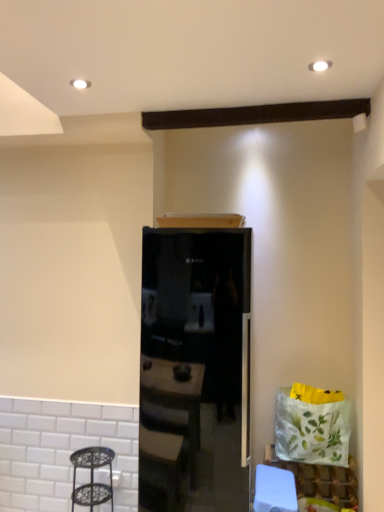
Question: Is white paper bag at lower right behind black glass refrigerator at center?

Choices:
 (A) yes
 (B) no

Answer: (A)

Question: Can you confirm if white paper bag at lower right is smaller than black glass refrigerator at center?

Choices:
 (A) yes
 (B) no

Answer: (A)

Question: Is white paper bag at lower right facing towards black glass refrigerator at center?

Choices:
 (A) yes
 (B) no

Answer: (B)

Question: Can you confirm if white paper bag at lower right is bigger than black glass refrigerator at center?

Choices:
 (A) no
 (B) yes

Answer: (A)

Question: Is white paper bag at lower right placed right next to black glass refrigerator at center?

Choices:
 (A) no
 (B) yes

Answer: (A)

Question: Is white paper bag at lower right thinner than black glass refrigerator at center?

Choices:
 (A) no
 (B) yes

Answer: (B)

Question: Does metallic black step stool at lower left have a greater height compared to black glass refrigerator at center?

Choices:
 (A) yes
 (B) no

Answer: (B)

Question: From the image's perspective, is metallic black step stool at lower left located above black glass refrigerator at center?

Choices:
 (A) yes
 (B) no

Answer: (B)

Question: From the image's perspective, is metallic black step stool at lower left below black glass refrigerator at center?

Choices:
 (A) yes
 (B) no

Answer: (A)

Question: Are metallic black step stool at lower left and black glass refrigerator at center making contact?

Choices:
 (A) yes
 (B) no

Answer: (B)

Question: Is metallic black step stool at lower left further to camera compared to black glass refrigerator at center?

Choices:
 (A) no
 (B) yes

Answer: (B)

Question: Is metallic black step stool at lower left far from black glass refrigerator at center?

Choices:
 (A) no
 (B) yes

Answer: (A)

Question: From the image's perspective, is black glass refrigerator at center beneath white paper bag at lower right?

Choices:
 (A) no
 (B) yes

Answer: (A)